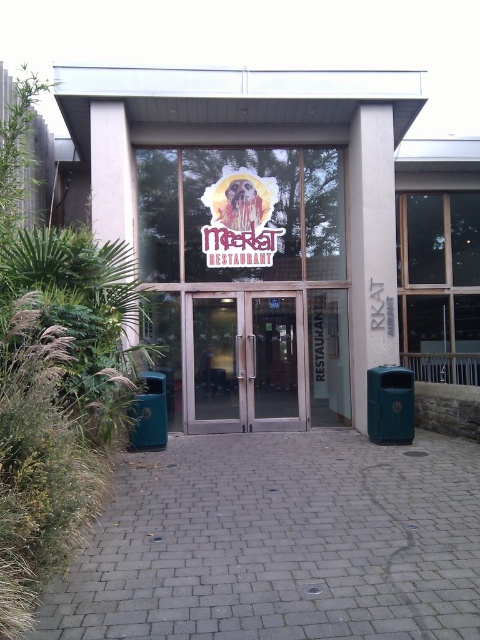
You are standing at the entrance of the Meerkat Restaurant. You notice a metallic glass door at center and a camera. How far apart are these two items?

The metallic glass door at center and the camera are 10.08 meters apart.

You are a delivery person arriving at the Meerkat Restaurant entrance. You need to enter through the doors. Which door should you use, the transparent glass doors at center or the metallic glass door at center, and why?

You should use the transparent glass doors at center because they are taller than the metallic glass door at center, making them more likely to be the main entrance for deliveries.

You are standing at the entrance of the Meerkat Restaurant and notice two points marked on the ground. The first point is at coordinates point (268, 348) and the second is at point (295, 412). If you want to step closer to the restaurant entrance, which point should you move toward?

You should move toward point (268, 348) because it is closer to the entrance than point (295, 412).